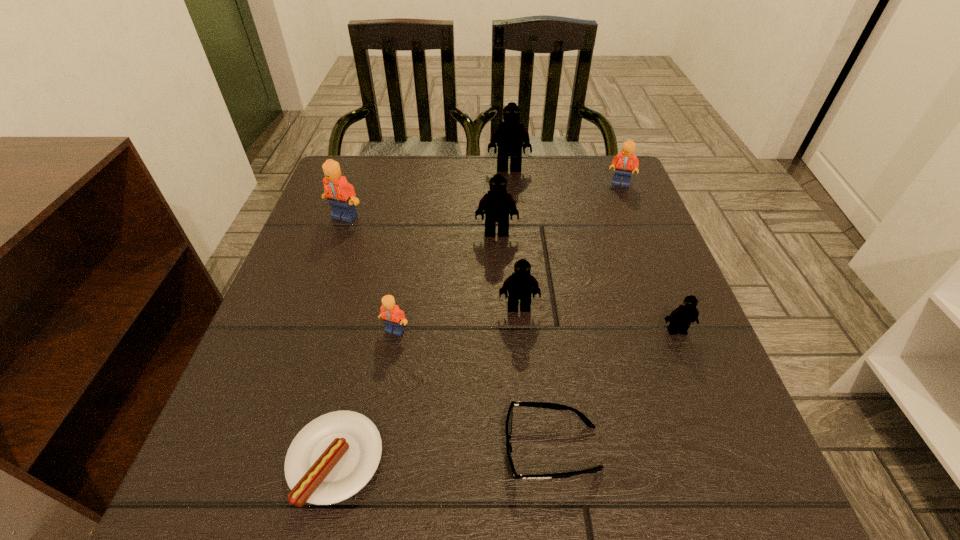
Locate an element on the screen. This screenshot has height=540, width=960. the farthest black Lego is located at coordinates click(508, 135).

This screenshot has height=540, width=960. In order to click on the tallest Lego in this screenshot , I will do `click(508, 135)`.

The image size is (960, 540). I want to click on the leftmost orange Lego, so click(x=341, y=195).

Where is `the seventh nearest object`? This screenshot has width=960, height=540. the seventh nearest object is located at coordinates (341, 195).

Image resolution: width=960 pixels, height=540 pixels. Find the location of `the sixth nearest object`. the sixth nearest object is located at coordinates (496, 204).

Where is `the second biggest black Lego`? the second biggest black Lego is located at coordinates (496, 204).

Identify the location of the rightmost orange Lego. (625, 161).

What are the coordinates of `the second farthest object` in the screenshot? It's located at (625, 161).

At what (x,y) coordinates should I click in order to perform the action: click on the second smallest black Lego. Please return your answer as a coordinate pair (x, y). Looking at the image, I should click on pyautogui.click(x=521, y=285).

Where is `the third farthest black Lego`? The image size is (960, 540). the third farthest black Lego is located at coordinates (521, 285).